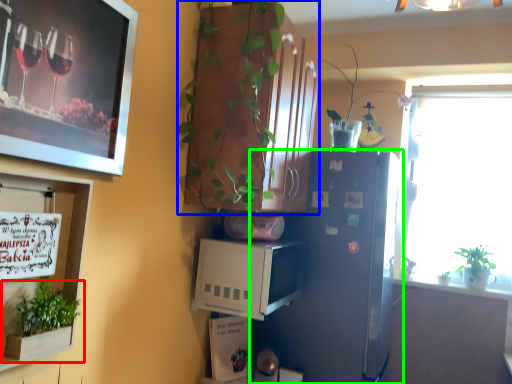
Question: Estimate the real-world distances between objects in this image. Which object is closer to houseplant (highlighted by a red box), cabinetry (highlighted by a blue box) or refrigerator (highlighted by a green box)?

Choices:
 (A) cabinetry
 (B) refrigerator

Answer: (A)